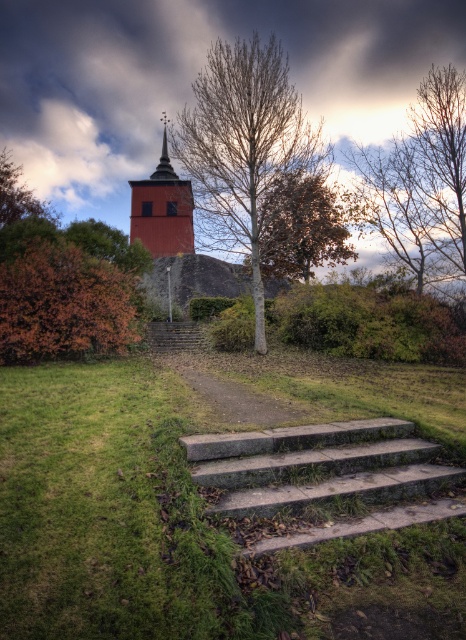
Question: Can you confirm if gray concrete stairs at center is smaller than brown leafy tree at upper left?

Choices:
 (A) yes
 (B) no

Answer: (A)

Question: Which object is farther from the camera taking this photo?

Choices:
 (A) bare branches at upper center
 (B) green mossy rock at center
 (C) autumn leaves at left
 (D) brown textured tree at center

Answer: (A)

Question: Where is bare wood tree at center located in relation to green mossy rock at center in the image?

Choices:
 (A) above
 (B) below

Answer: (A)

Question: Can you confirm if green grass at lower left is thinner than gray concrete stairs at center?

Choices:
 (A) yes
 (B) no

Answer: (B)

Question: Which object is positioned farthest from the concrete stairs at center?

Choices:
 (A) green mossy rock at center
 (B) brown textured tree at center
 (C) bare wood tree at center
 (D) autumn leaves at left

Answer: (C)

Question: Which object appears closest to the camera in this image?

Choices:
 (A) gray concrete stairs at center
 (B) bare wood tree at center
 (C) bare branches at upper center
 (D) brown textured tree at center

Answer: (A)